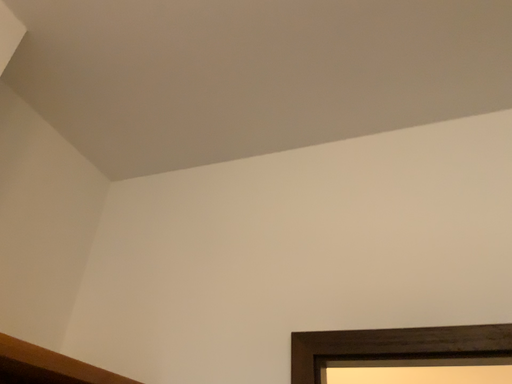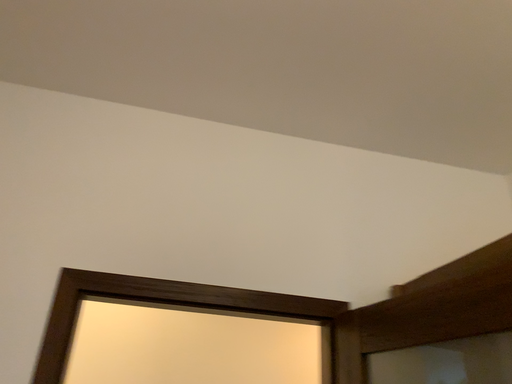
Question: How did the camera likely rotate when shooting the video?

Choices:
 (A) rotated upward
 (B) rotated downward

Answer: (B)